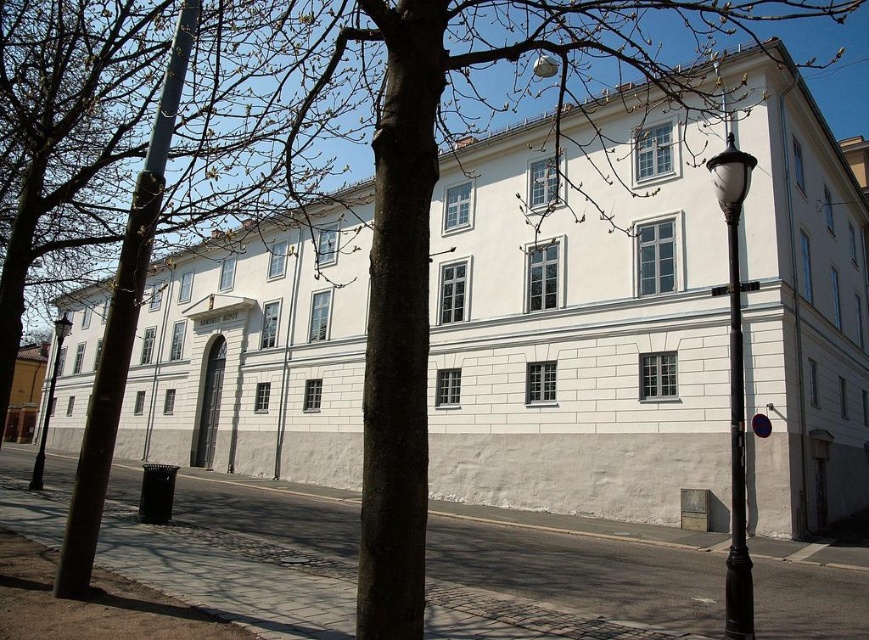
Question: Can you confirm if black metal lamp post at right is thinner than black glass lamp post at left?

Choices:
 (A) no
 (B) yes

Answer: (B)

Question: Which of the following is the closest to the observer?

Choices:
 (A) (733, 284)
 (B) (58, 573)
 (C) (45, 410)
 (D) (740, 516)

Answer: (B)

Question: Can you confirm if black polished metal pole at right is smaller than black glass lamp post at left?

Choices:
 (A) no
 (B) yes

Answer: (B)

Question: Among these objects, which one is farthest from the camera?

Choices:
 (A) metallic pole at left
 (B) black polished metal pole at right

Answer: (A)

Question: Does black polished metal pole at right have a greater width compared to black glass lamp post at left?

Choices:
 (A) no
 (B) yes

Answer: (A)

Question: Which point appears closest to the camera in this image?

Choices:
 (A) (183, 58)
 (B) (737, 433)
 (C) (727, 250)
 (D) (45, 442)

Answer: (B)